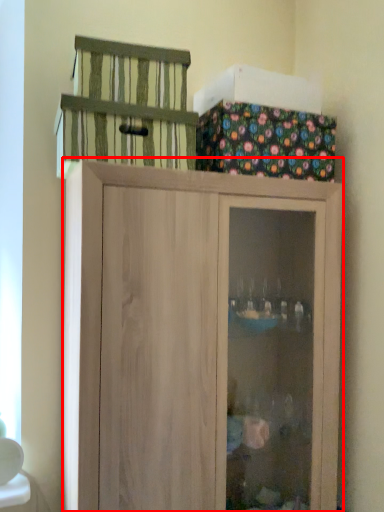
Question: Considering the relative positions of cupboard (annotated by the red box) and cage in the image provided, where is cupboard (annotated by the red box) located with respect to the staircase?

Choices:
 (A) right
 (B) left

Answer: (A)